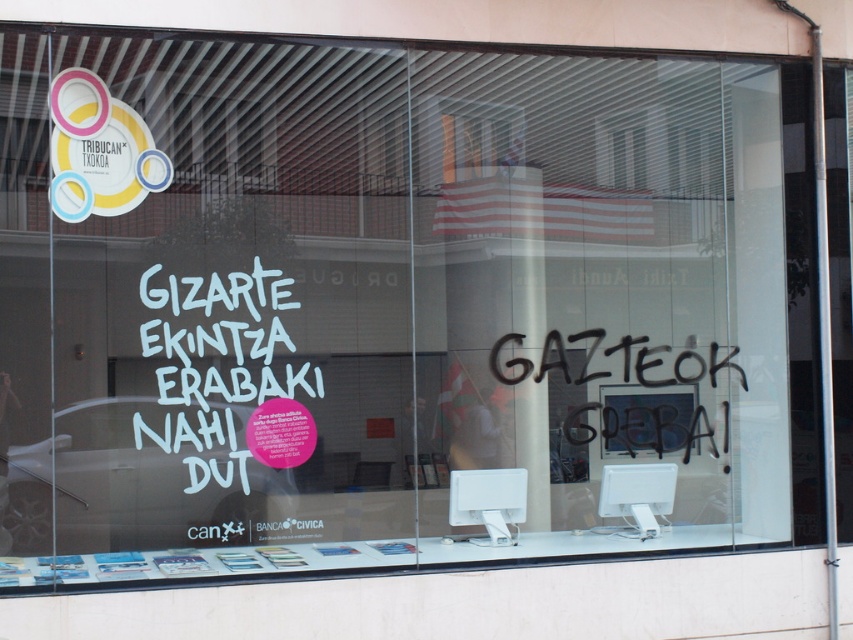
You are a customer standing in front of the storefront window described. You notice a point marked at coordinates (216, 369). Based on the scene, what object or feature does this point correspond to?

The point at coordinates (216, 369) corresponds to the white vinyl text at center, which reads large white letters spelling out GIZARTE EKINTZA ERABAKI NAHI DUT.

You are designing a poster for a community event and need to know which text element on the storefront window is narrower. The texts are the white vinyl text at center and the black spray paint at center. Which one is narrower?

The white vinyl text at center is narrower than the black spray paint at center.